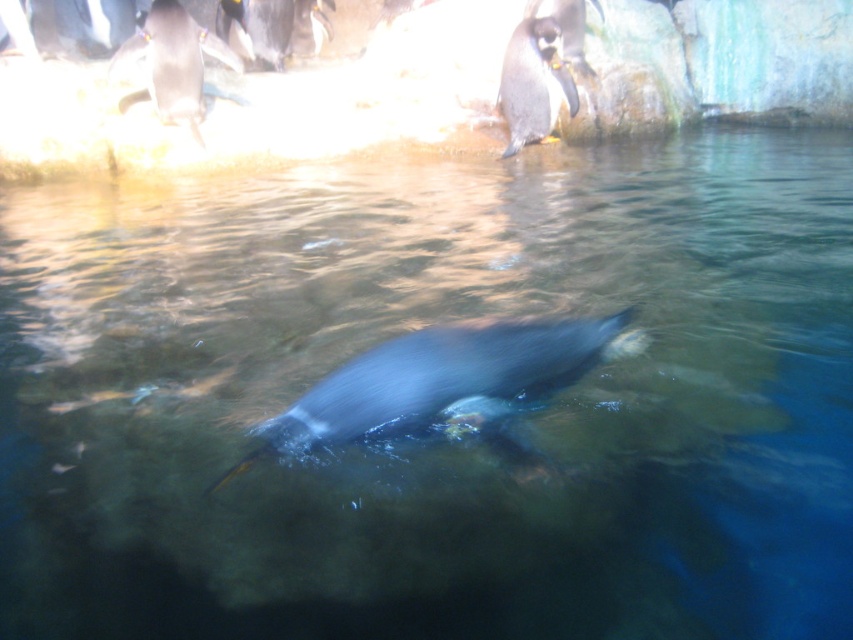
You are a zookeeper observing the penguin exhibit. You notice a specific point marked at coordinates point (440, 381). What animal is located at this point?

The point (440, 381) corresponds to the shiny black penguin at center.

You are a penguin trainer observing the exhibit. You notice two points marked in the water where penguins might surface. The first point is at coordinates point (x=572, y=324), and the second is at point (x=315, y=12). Which point is closer to the penguin currently swimming in the foreground?

Point (x=572, y=324) is in front of point (x=315, y=12), so the penguin currently swimming in the foreground is closer to point (x=572, y=324).